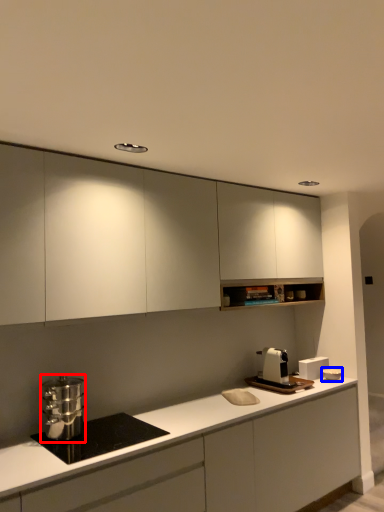
Question: Which object appears farthest to the camera in this image, kitchen appliance (highlighted by a red box) or appliance (highlighted by a blue box)?

Choices:
 (A) kitchen appliance
 (B) appliance

Answer: (B)